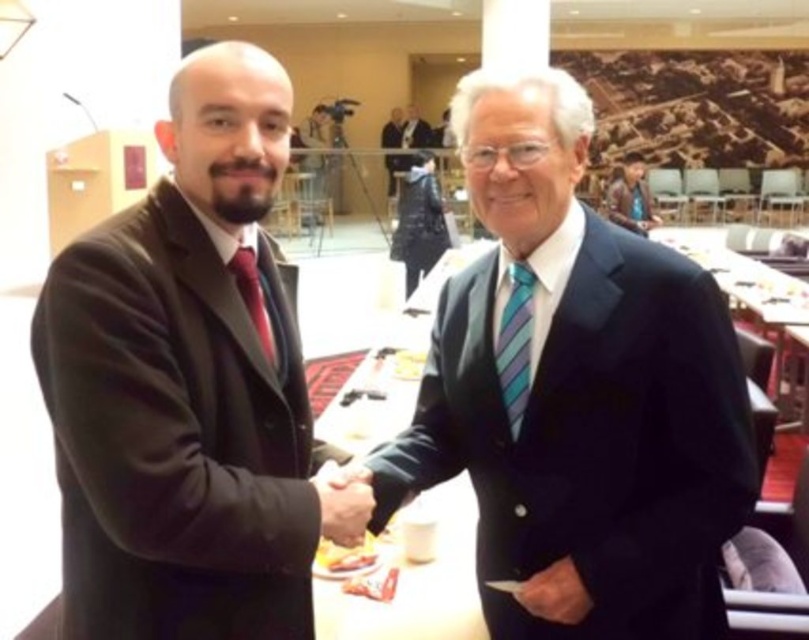
You are organizing a formal event and need to ensure that the matte black suit at left and the striped fabric tie at right are displayed together in a showcase. Given their sizes, which one should be placed lower to avoid blocking the other?

The striped fabric tie at right should be placed lower since the matte black suit at left is larger and needs more vertical space to be properly displayed without blocking the tie.

You are an event photographer at a conference. You need to capture a photo of the two men shaking hands while ensuring that the brown leather jacket at upper right and the matte red tie at center are visible in the frame. Based on their positions, which object is located to the right side of the other?

The brown leather jacket at upper right is to the right of the matte red tie at center.